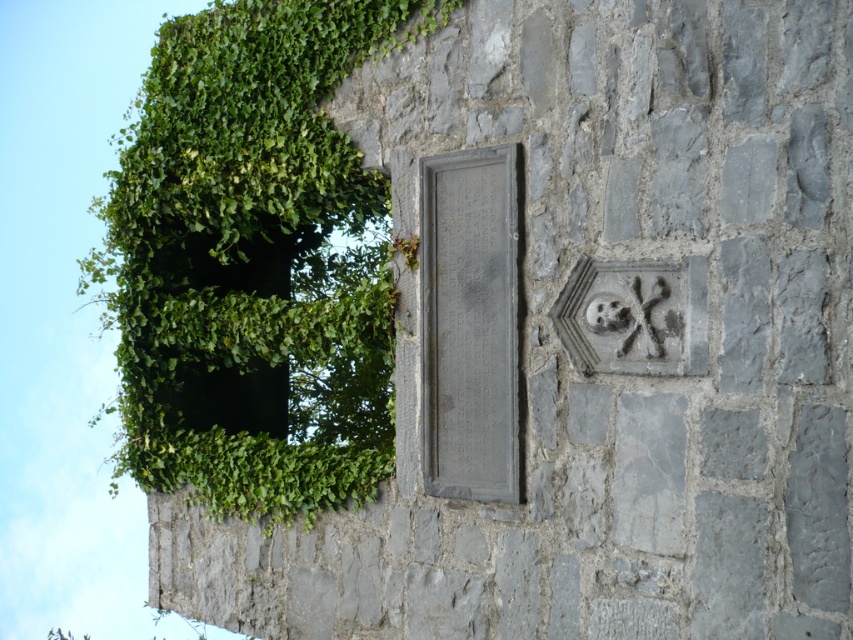
You are a gardener assessing the space around the gray stone plaque at center. There is a green leafy plant at upper left nearby. Do you think the plant could potentially block the plaque from view if it grows wider?

The green leafy plant at upper left might be wider than the gray stone plaque at center, so there is a possibility that if it continues to grow, it could obstruct the view of the plaque.

You are a botanist examining the stone wall and notice the green leafy plant at upper left and the gray stone plaque at center. Which object occupies a greater area on the wall?

The green leafy plant at upper left has a larger size compared to the gray stone plaque at center, so it occupies a greater area on the wall.